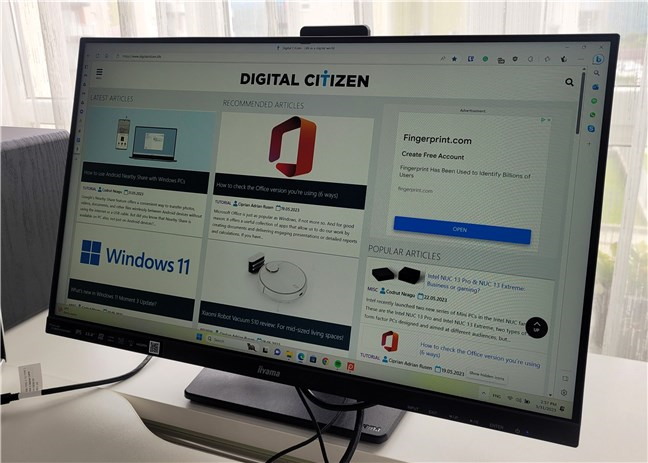
Locate an element on the screen. desk is located at coordinates (159, 391).